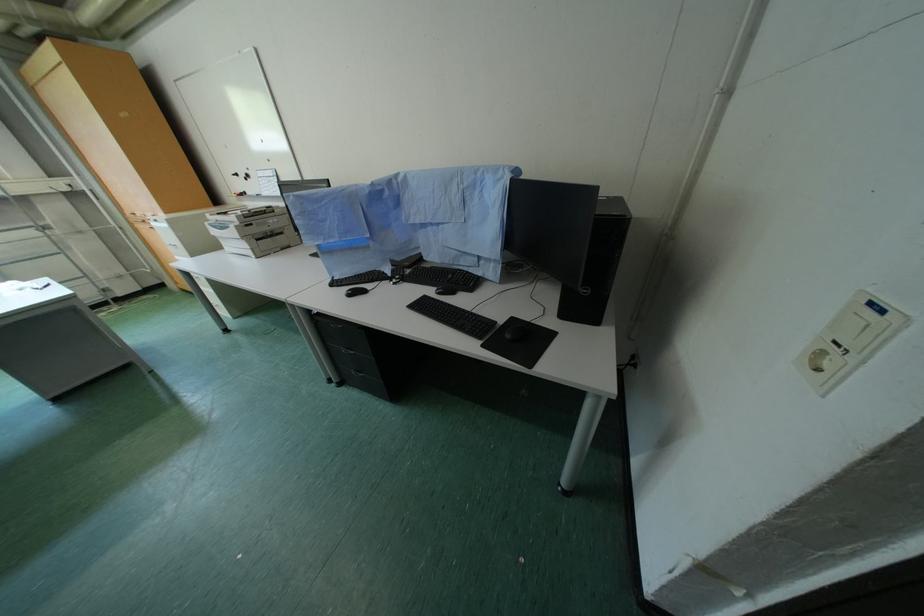
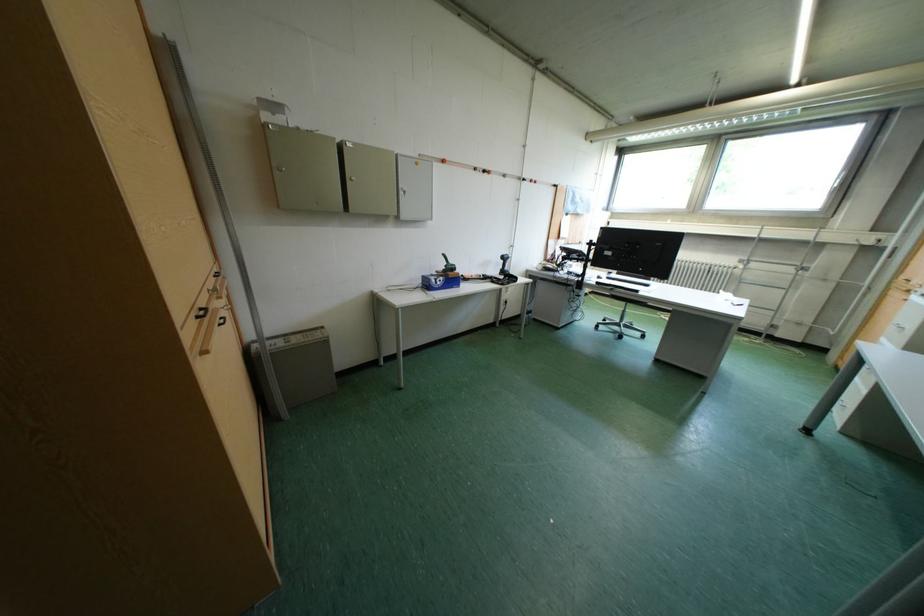
Based on the photo, the first image is from the beginning of the video and the second image is from the end. How did the camera likely rotate when shooting the video?

The rotation direction of the camera is left-down.